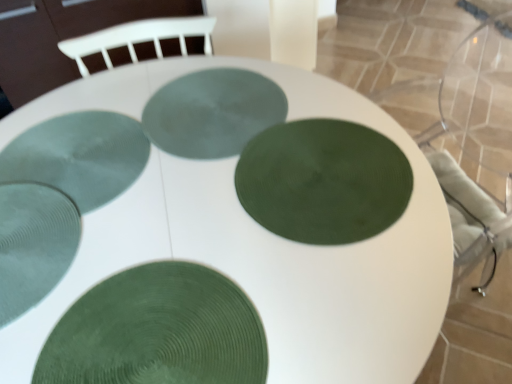
In order to click on free area in between green textured glass plate at center, which appears as the 5th glass plate when viewed from the front, and green textured plate at center, which is the 5th glass plate from back to front in this screenshot , I will do `click(188, 213)`.